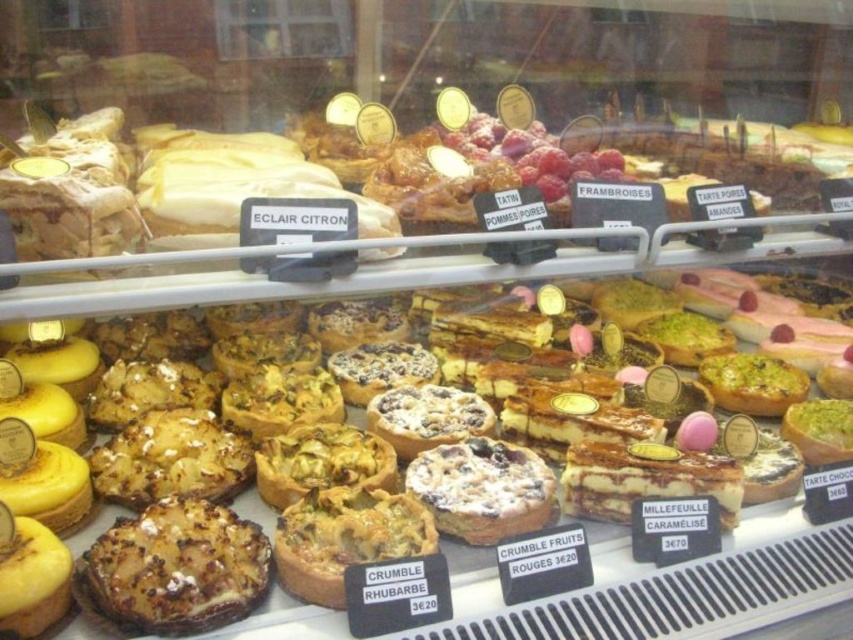
You are a customer at the bakery and want to choose between the golden brown flaky tart at center and the crumbly brown tart at center. Which one has a bigger size in terms of width?

The golden brown flaky tart at center has a larger width than the crumbly brown tart at center.

You are a customer at the bakery and want to point out the golden flaky tartlet at center and the golden brown flaky tart at lower left to the cashier. Which one is positioned higher in the display case?

The golden flaky tartlet at center is positioned higher than the golden brown flaky tart at lower left in the display case.

What is located at the point with coordinates (175, 568) in the display case?

The golden brown flaky tart at center is located at point (175, 568) in the display case.